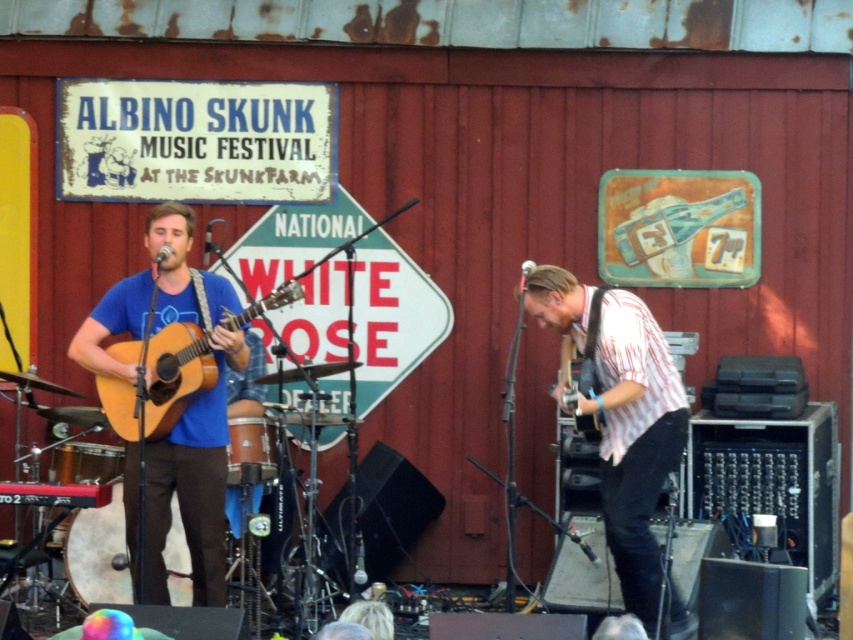
Is matte blue shirt at left in front of matte wood guitar at left?

That is False.

Who is more forward, [202,497] or [163,360]?

Point [163,360] is in front.

Where is `matte blue shirt at left`? This screenshot has width=853, height=640. matte blue shirt at left is located at coordinates (194, 468).

Identify the location of matte blue shirt at left. This screenshot has height=640, width=853. (194, 468).

Can you confirm if matte wood guitar at left is positioned below matte black electric guitar at right?

Incorrect, matte wood guitar at left is not positioned below matte black electric guitar at right.

Is matte wood guitar at left to the right of matte black electric guitar at right from the viewer's perspective?

Incorrect, matte wood guitar at left is not on the right side of matte black electric guitar at right.

The image size is (853, 640). In order to click on matte wood guitar at left in this screenshot , I will do `click(157, 380)`.

Image resolution: width=853 pixels, height=640 pixels. I want to click on matte wood guitar at left, so click(x=157, y=380).

Based on the photo, which is more to the right, matte blue shirt at left or matte black electric guitar at right?

matte black electric guitar at right is more to the right.

Which is more to the left, matte blue shirt at left or matte black electric guitar at right?

matte blue shirt at left

Between point (126, 289) and point (590, 358), which one is positioned behind?

The point (126, 289) is behind.

The image size is (853, 640). Find the location of `matte blue shirt at left`. matte blue shirt at left is located at coordinates (194, 468).